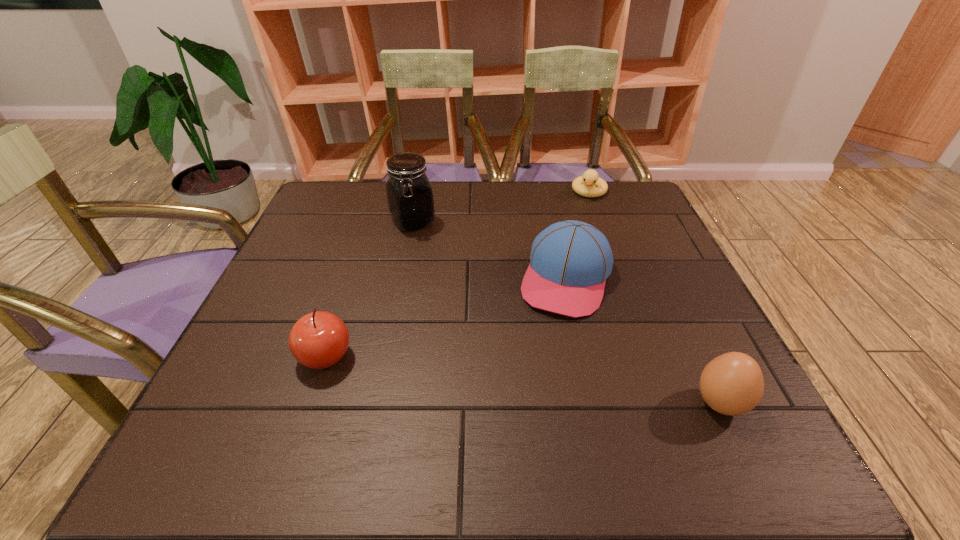
You are a GUI agent. You are given a task and a screenshot of the screen. Output one action in this format:
    pyautogui.click(x=<x>, y=<y>)
    Task: Click on the apple that is at the near edge
    Image resolution: width=960 pixels, height=540 pixels.
    Given the screenshot: What is the action you would take?
    pos(318,340)

In order to click on boiled egg that is at the near edge in this screenshot , I will do `click(732, 384)`.

Image resolution: width=960 pixels, height=540 pixels. Identify the location of object that is at the left edge. (318, 340).

Where is `boiled egg that is positioned at the right edge`? The image size is (960, 540). boiled egg that is positioned at the right edge is located at coordinates (732, 384).

At what (x,y) coordinates should I click in order to perform the action: click on duckling situated at the right edge. Please return your answer as a coordinate pair (x, y). Looking at the image, I should click on (584, 185).

Find the location of a particular element. This screenshot has width=960, height=540. object that is at the near left corner is located at coordinates (318, 340).

Image resolution: width=960 pixels, height=540 pixels. I want to click on object at the far right corner, so click(584, 185).

In order to click on object that is at the near right corner in this screenshot , I will do `click(732, 384)`.

This screenshot has width=960, height=540. I want to click on vacant area at the far edge, so click(440, 219).

In the image, there is a desktop. Find the location of `vacant region at the left edge`. vacant region at the left edge is located at coordinates (296, 266).